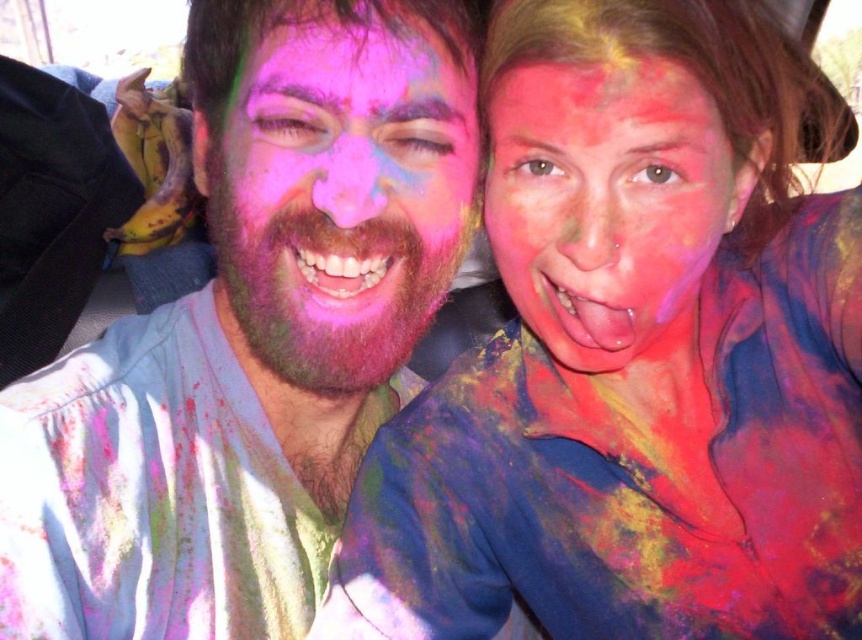
You are a photographer trying to capture the scene of two people in a car after a festival. You need to position your camera so that both the matte multicolored face paint at center and the pink matte face at center are visible. Based on their positions, which face should you focus on first to ensure both are in frame?

The matte multicolored face paint at center is below the pink matte face at center, so you should focus on the pink matte face at center first to ensure both are in frame.

You are a photographer trying to capture a closeup of the matte multicolored face at center and the multicolored powder at center in the image. Which object should you focus on first if you want to ensure both are in focus without adjusting the camera settings?

The matte multicolored face at center is taller than the multicolored powder at center, so focusing on it first will ensure both are in focus since it is larger.